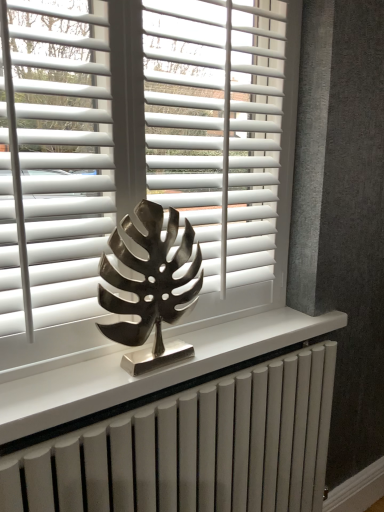
You are a GUI agent. You are given a task and a screenshot of the screen. Output one action in this format:
    pyautogui.click(x=<x>, y=<y>)
    Task: Click on the free spot below metallic leaf sculpture at center (from a real-world perspective)
    The image size is (384, 512).
    Given the screenshot: What is the action you would take?
    pyautogui.click(x=137, y=365)